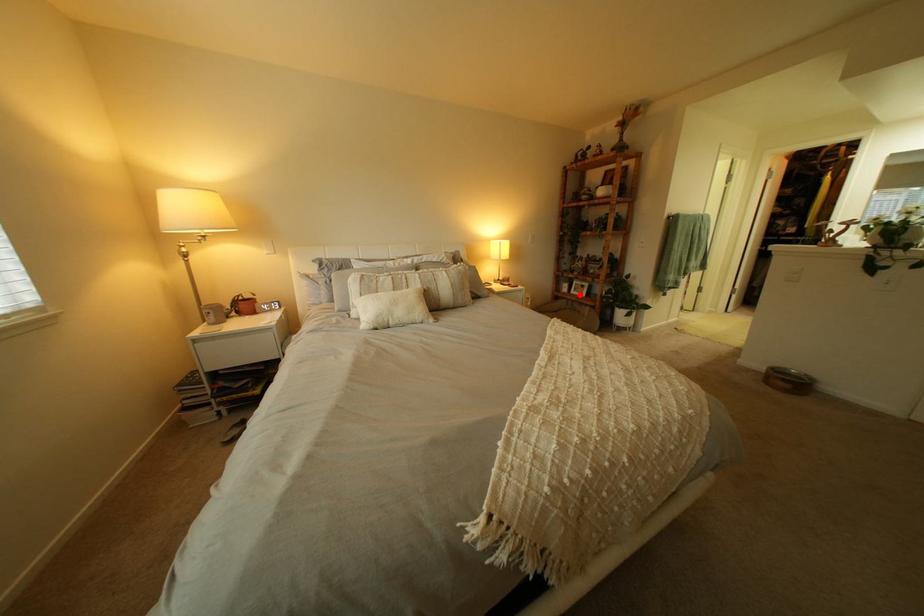
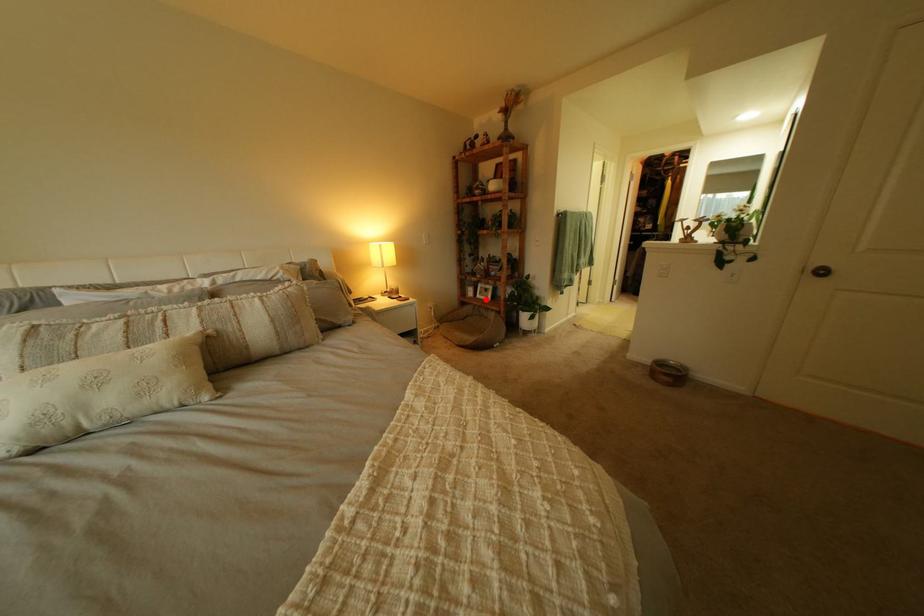
I am providing you with two images of the same scene from different viewpoints. A red point is marked on the first image and another point is marked on the second image. Is the red point in image1 aligned with the point shown in image2?

Yes